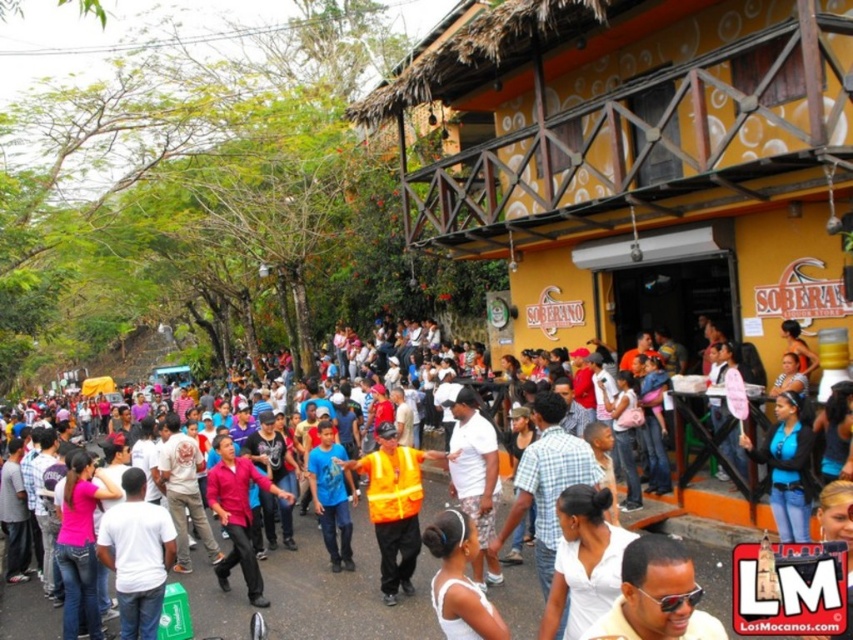
Between white matte shirt at center and matte pink shirt at center, which one is positioned higher?

matte pink shirt at center is above.

Identify the location of white matte shirt at center. Image resolution: width=853 pixels, height=640 pixels. (137, 556).

Can you confirm if orange reflective vest at center is taller than white matte shirt at center?

Indeed, orange reflective vest at center has a greater height compared to white matte shirt at center.

Which of these two, orange reflective vest at center or white matte shirt at center, stands taller?

Standing taller between the two is orange reflective vest at center.

The width and height of the screenshot is (853, 640). What do you see at coordinates (340, 592) in the screenshot?
I see `orange reflective vest at center` at bounding box center [340, 592].

You are a GUI agent. You are given a task and a screenshot of the screen. Output one action in this format:
    pyautogui.click(x=<x>, y=<y>)
    Task: Click on the orange reflective vest at center
    The height and width of the screenshot is (640, 853).
    Given the screenshot: What is the action you would take?
    pyautogui.click(x=340, y=592)

Is matte yellow shirt at center thinner than white matte shirt at center?

No, matte yellow shirt at center is not thinner than white matte shirt at center.

Is matte yellow shirt at center positioned in front of white matte shirt at center?

Yes.

Locate an element on the screen. This screenshot has width=853, height=640. matte yellow shirt at center is located at coordinates (656, 596).